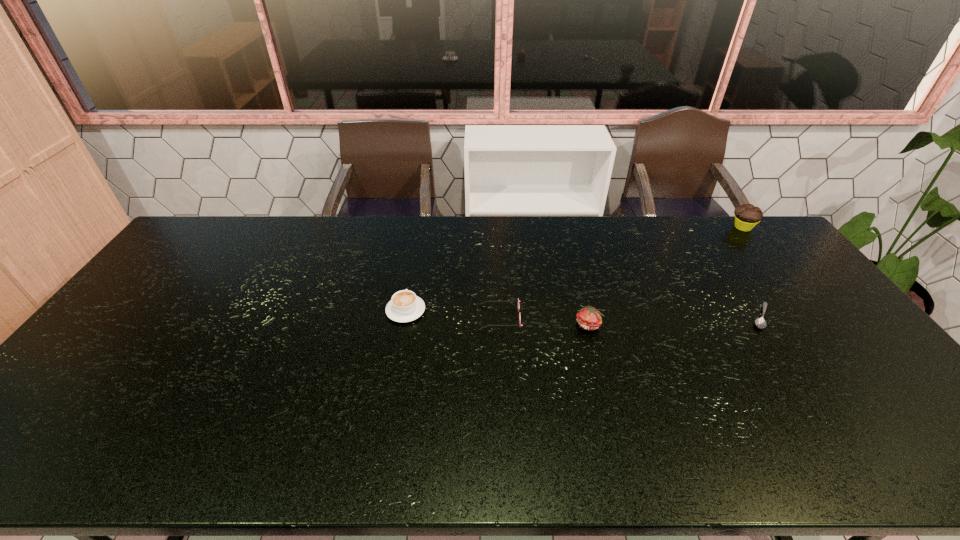
You are a GUI agent. You are given a task and a screenshot of the screen. Output one action in this format:
    pyautogui.click(x=<x>, y=<y>)
    Task: Click on the object that is at the right edge
    
    Given the screenshot: What is the action you would take?
    pyautogui.click(x=747, y=216)

The width and height of the screenshot is (960, 540). I want to click on object at the far right corner, so click(x=747, y=216).

Where is `blank area at the far edge`? blank area at the far edge is located at coordinates (422, 239).

The width and height of the screenshot is (960, 540). I want to click on vacant space at the near edge, so click(x=654, y=452).

This screenshot has height=540, width=960. I want to click on free space at the right edge of the desktop, so click(x=849, y=377).

Locate an element on the screen. vacant region between the soupspoon and the muffin is located at coordinates (752, 272).

Find the location of a particular element. The width and height of the screenshot is (960, 540). empty location between the fourth object from left to right and the fourth tallest object is located at coordinates (631, 317).

Locate an element on the screen. The image size is (960, 540). empty space that is in between the fourth object from left to right and the farthest object is located at coordinates (752, 272).

Identify the location of free space between the third tallest object and the second shortest object. (453, 314).

You are a GUI agent. You are given a task and a screenshot of the screen. Output one action in this format:
    pyautogui.click(x=<x>, y=<y>)
    Task: Click on the vacant space that is in between the leftmost object and the muffin
    
    Given the screenshot: What is the action you would take?
    pyautogui.click(x=574, y=269)